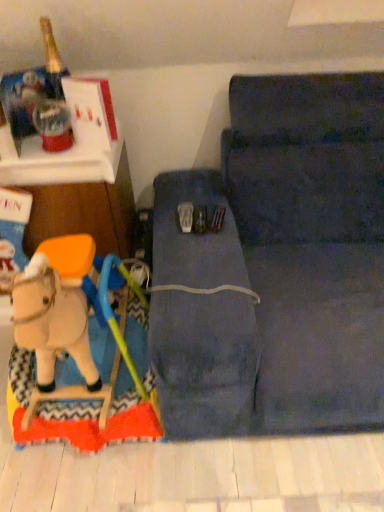
Question: Is dark blue fabric studio couch at center turned away from wooden matte horse at lower left?

Choices:
 (A) yes
 (B) no

Answer: (B)

Question: Does dark blue fabric studio couch at center turn towards wooden matte horse at lower left?

Choices:
 (A) yes
 (B) no

Answer: (B)

Question: Is dark blue fabric studio couch at center closer to the viewer compared to wooden matte horse at lower left?

Choices:
 (A) no
 (B) yes

Answer: (B)

Question: Does dark blue fabric studio couch at center lie behind wooden matte horse at lower left?

Choices:
 (A) no
 (B) yes

Answer: (A)

Question: Could wooden matte horse at lower left be considered to be inside dark blue fabric studio couch at center?

Choices:
 (A) yes
 (B) no

Answer: (B)

Question: From the image's perspective, is dark blue fabric studio couch at center above or below wooden matte horse at lower left?

Choices:
 (A) below
 (B) above

Answer: (B)

Question: From a real-world perspective, is dark blue fabric studio couch at center physically located above or below wooden matte horse at lower left?

Choices:
 (A) above
 (B) below

Answer: (A)

Question: Considering the positions of dark blue fabric studio couch at center and wooden matte horse at lower left in the image, is dark blue fabric studio couch at center wider or thinner than wooden matte horse at lower left?

Choices:
 (A) thin
 (B) wide

Answer: (B)

Question: From their relative heights in the image, would you say dark blue fabric studio couch at center is taller or shorter than wooden matte horse at lower left?

Choices:
 (A) short
 (B) tall

Answer: (B)

Question: Considering the positions of point (347, 174) and point (71, 223), is point (347, 174) closer or farther from the camera than point (71, 223)?

Choices:
 (A) closer
 (B) farther

Answer: (A)

Question: Based on their positions, is dark blue fabric studio couch at center located to the left or right of wooden rocking horse at left?

Choices:
 (A) right
 (B) left

Answer: (A)

Question: In terms of height, does dark blue fabric studio couch at center look taller or shorter compared to wooden rocking horse at left?

Choices:
 (A) short
 (B) tall

Answer: (A)

Question: Considering their positions, is dark blue fabric studio couch at center located in front of or behind wooden rocking horse at left?

Choices:
 (A) behind
 (B) front

Answer: (B)

Question: From the image's perspective, is wooden matte horse at lower left above or below wooden rocking horse at left?

Choices:
 (A) above
 (B) below

Answer: (B)

Question: Is wooden matte horse at lower left situated inside wooden rocking horse at left or outside?

Choices:
 (A) outside
 (B) inside

Answer: (A)